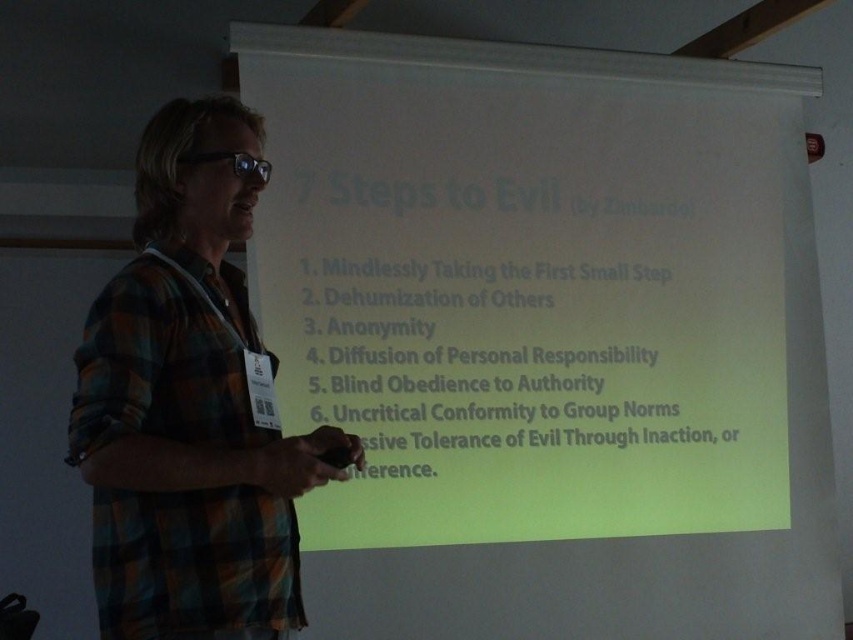
Question: Among these points, which one is nearest to the camera?

Choices:
 (A) (238, 464)
 (B) (633, 221)

Answer: (A)

Question: Which of the following is the farthest from the observer?

Choices:
 (A) white matte projection screen at center
 (B) plaid fabric shirt at center

Answer: (A)

Question: Among these points, which one is nearest to the camera?

Choices:
 (A) (428, 497)
 (B) (115, 506)

Answer: (B)

Question: Is white matte projection screen at center positioned before plaid fabric shirt at center?

Choices:
 (A) no
 (B) yes

Answer: (A)

Question: Is white matte projection screen at center thinner than plaid fabric shirt at center?

Choices:
 (A) yes
 (B) no

Answer: (B)

Question: Does white matte projection screen at center have a lesser width compared to plaid fabric shirt at center?

Choices:
 (A) no
 (B) yes

Answer: (A)